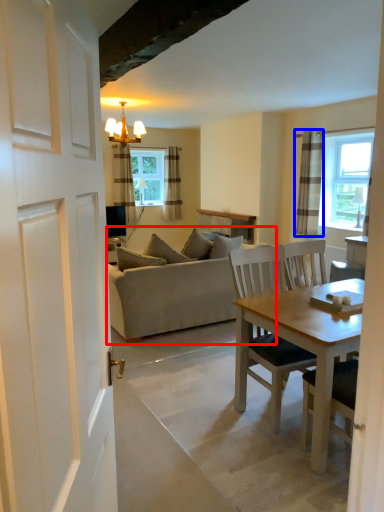
Question: Which object is closer to the camera taking this photo, studio couch (highlighted by a red box) or curtain (highlighted by a blue box)?

Choices:
 (A) studio couch
 (B) curtain

Answer: (A)